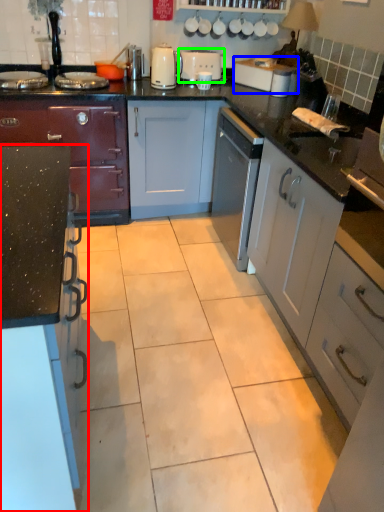
Question: Which object is positioned closest to cabinetry (highlighted by a red box)? Select from toaster (highlighted by a blue box) and appliance (highlighted by a green box).

Choices:
 (A) toaster
 (B) appliance

Answer: (A)